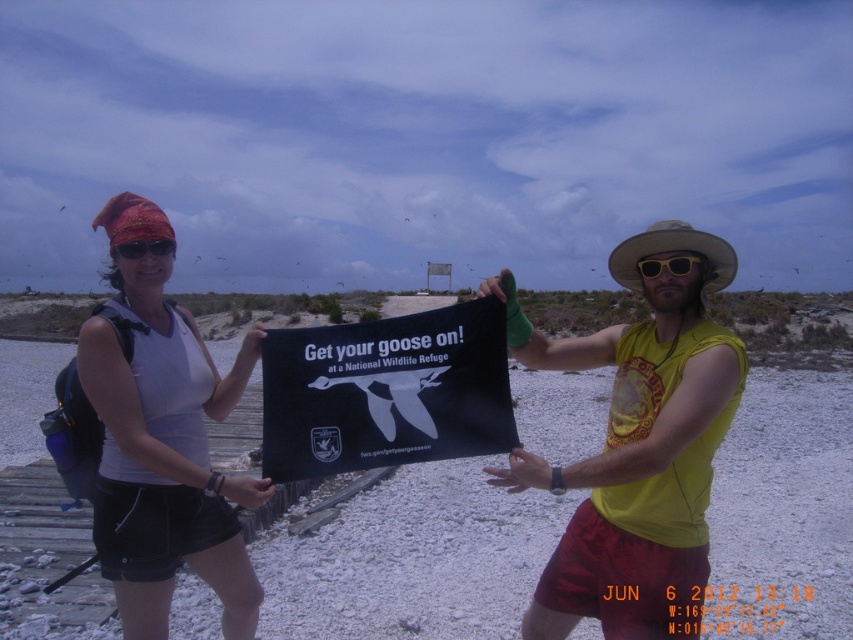
Can you confirm if yellow sleeveless shirt at center is smaller than yellow plastic goggles at center?

No.

You are a GUI agent. You are given a task and a screenshot of the screen. Output one action in this format:
    pyautogui.click(x=<x>, y=<y>)
    Task: Click on the yellow sleeveless shirt at center
    The image size is (853, 640).
    Given the screenshot: What is the action you would take?
    pyautogui.click(x=636, y=445)

Who is more distant from viewer, (x=589, y=353) or (x=672, y=269)?

The point (x=589, y=353) is behind.

This screenshot has width=853, height=640. I want to click on yellow sleeveless shirt at center, so click(636, 445).

Is black fabric sign at center thinner than yellow plastic goggles at center?

Incorrect, black fabric sign at center's width is not less than yellow plastic goggles at center's.

Which is behind, point (349, 385) or point (640, 273)?

The point (640, 273) is behind.

At what (x,y) coordinates should I click in order to perform the action: click on black fabric sign at center. Please return your answer as a coordinate pair (x, y). This screenshot has height=640, width=853. Looking at the image, I should click on (386, 392).

Does yellow sleeveless shirt at center have a greater width compared to red fabric bandana at upper left?

Correct, the width of yellow sleeveless shirt at center exceeds that of red fabric bandana at upper left.

Is yellow sleeveless shirt at center closer to camera compared to red fabric bandana at upper left?

Yes.

Does point (706, 240) come closer to viewer compared to point (154, 243)?

Yes, point (706, 240) is in front of point (154, 243).

Where is `yellow sleeveless shirt at center`? yellow sleeveless shirt at center is located at coordinates (636, 445).